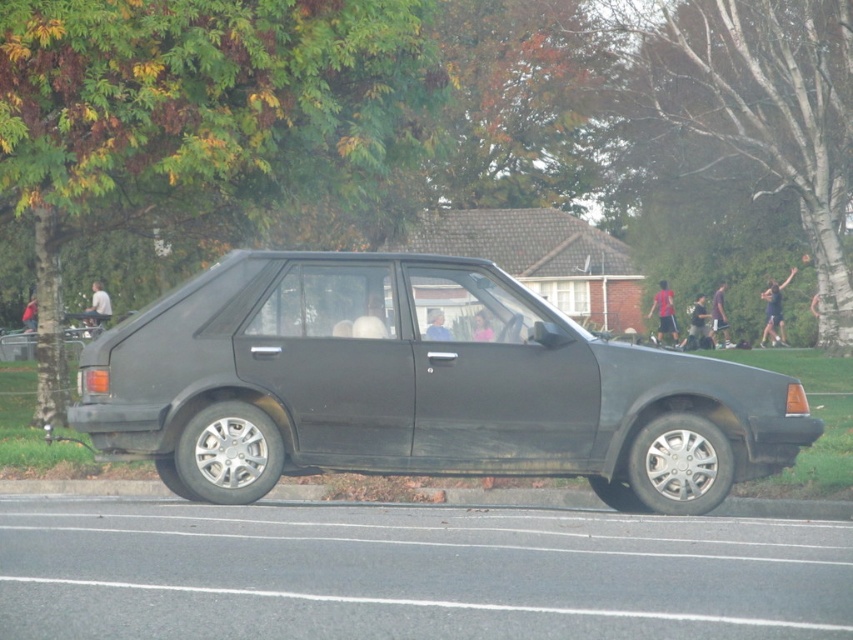
You are standing on the sidewalk and want to cross the road to reach the matte black sedan at center. If your walking speed is 1.5 meters per second, how many seconds will it take you to reach the sedan?

The distance between you and the matte black sedan at center is 11.24 meters. At a walking speed of 1.5 meters per second, it would take approximately 7.49 seconds to reach the sedan.

You are standing at the origin point of the image coordinate system. Where is the matte black sedan at center located in terms of coordinates?

The matte black sedan at center is located at coordinates point (418, 387).